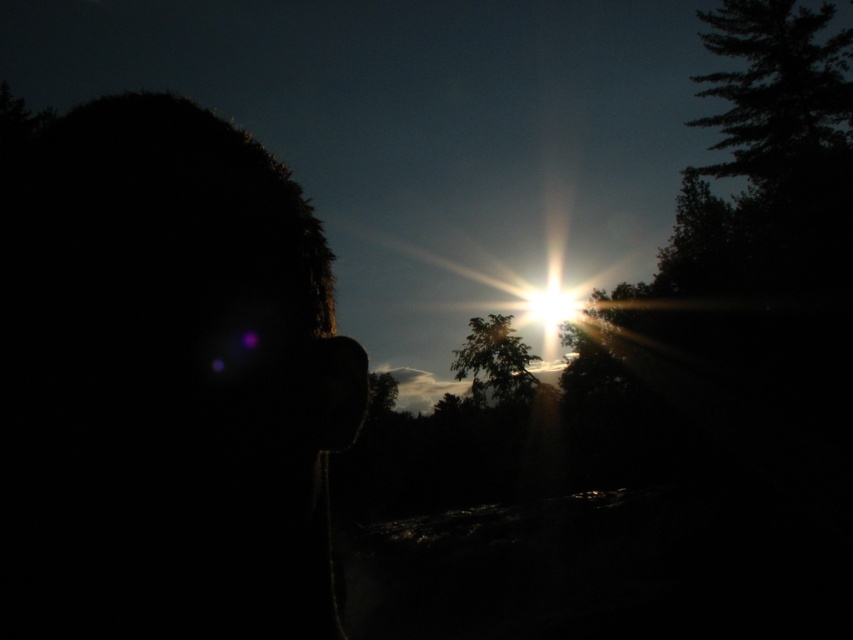
You are an artist trying to sketch the scene. You need to decide the relative sizes of the silhouette head at left and the green leafy tree at center. Which one is wider?

The silhouette head at left is narrower than the green leafy tree at center because its width is less than the tree.

You are standing in the outdoor scene and want to take a photo of the silhouette head at left. Where should you position your camera to capture it in the frame?

The silhouette head at left is located at point coordinates 0.597 on the x axis and 0.193 on the y axis. To capture it in the frame, position your camera so that the center of the viewfinder aligns with these coordinates.